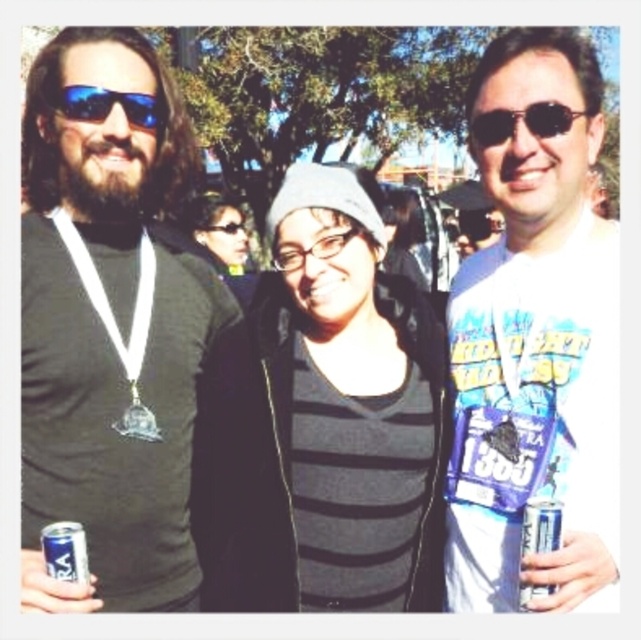
Consider the image. Based on the coordinates provided, which object is exactly at point (349,406)?

The striped fabric shirt at center is exactly at point (349,406).

You are organizing a photo shoot and need to know the relative sizes of the objects in the image. Given the scene described, which object is wider, the matte black shirt at left or the silver metallic can at center right?

The matte black shirt at left is wider than the silver metallic can at center right according to the description.

Looking at this image, you are a photographer at a sunny event and notice the matte black shirt at left and the blue reflective sunglasses at left. Which object would cast a larger shadow given their size?

The matte black shirt at left has a larger size compared to the blue reflective sunglasses at left, so it would cast a larger shadow.